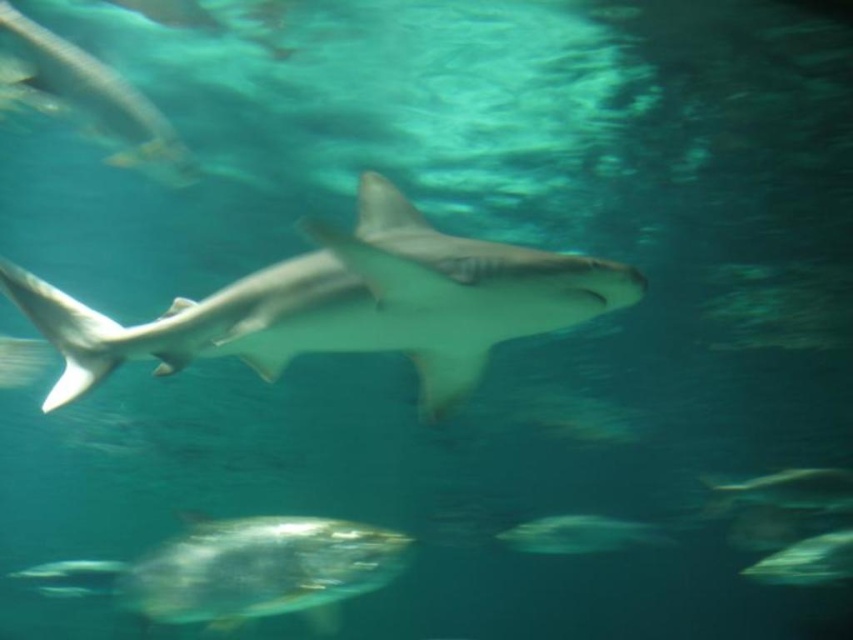
Which is more to the left, smooth gray shark at center or translucent gray fish at center?

Positioned to the left is smooth gray shark at center.

Which is behind, point (215, 332) or point (502, 541)?

Point (502, 541)

Locate an element on the screen. smooth gray shark at center is located at coordinates (345, 305).

Which is below, translucent gray shark at upper left or translucent gray fish at lower right?

translucent gray fish at lower right is below.

Is point (68, 51) positioned after point (843, 497)?

No, it is in front of (843, 497).

Between point (61, 77) and point (711, 490), which one is positioned behind?

The point (711, 490) is behind.

Where is `translucent gray shark at upper left`? The height and width of the screenshot is (640, 853). translucent gray shark at upper left is located at coordinates (96, 97).

Between translucent gray fish at lower right and green translucent fish at lower right, which one is positioned higher?

translucent gray fish at lower right

Can you confirm if translucent gray fish at lower right is wider than green translucent fish at lower right?

No.

Which is in front, point (747, 477) or point (833, 568)?

Point (833, 568) is in front.

Where is `translucent gray fish at lower right`? translucent gray fish at lower right is located at coordinates (785, 490).